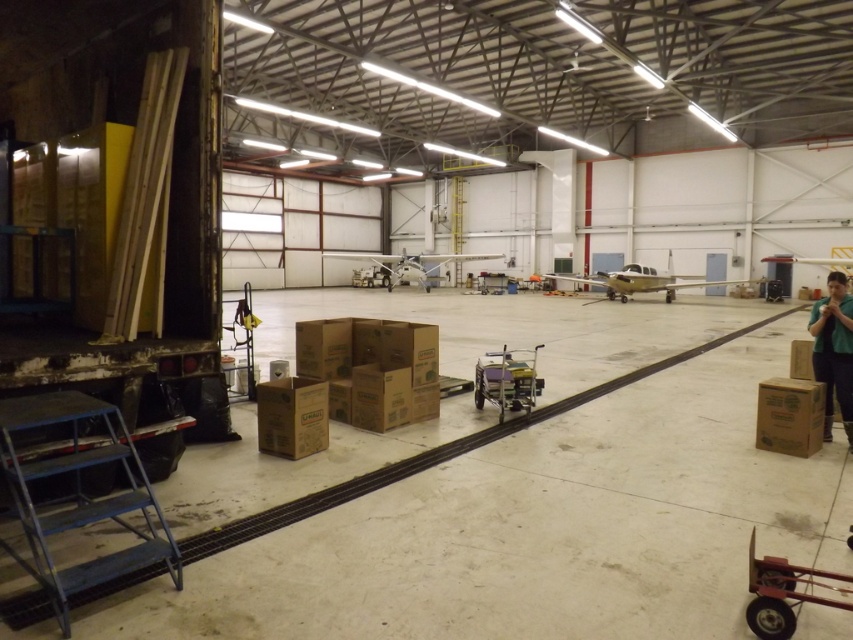
Is point (833, 348) in front of point (517, 401)?

Yes, it is in front of point (517, 401).

Between point (844, 426) and point (491, 394), which one is positioned in front?

Point (844, 426) is in front.

Is point (825, 381) positioned before point (521, 368)?

Yes, it is in front of point (521, 368).

At what (x,y) coordinates should I click in order to perform the action: click on green fabric shirt at right. Please return your answer as a coordinate pair (x, y). Looking at the image, I should click on (833, 349).

Is point (820, 586) positioned before point (782, 394)?

Yes, point (820, 586) is closer to viewer.

Is metallic red handcart at lower right above brown cardboard box at lower right?

Incorrect, metallic red handcart at lower right is not positioned above brown cardboard box at lower right.

Locate an element on the screen. metallic red handcart at lower right is located at coordinates (784, 593).

The height and width of the screenshot is (640, 853). What do you see at coordinates (784, 593) in the screenshot? I see `metallic red handcart at lower right` at bounding box center [784, 593].

Which is more to the left, metallic red handcart at lower right or metallic silver cart at center?

From the viewer's perspective, metallic silver cart at center appears more on the left side.

Does point (785, 609) come farther from viewer compared to point (520, 365)?

No, it is in front of (520, 365).

The height and width of the screenshot is (640, 853). In order to click on metallic red handcart at lower right in this screenshot , I will do `click(784, 593)`.